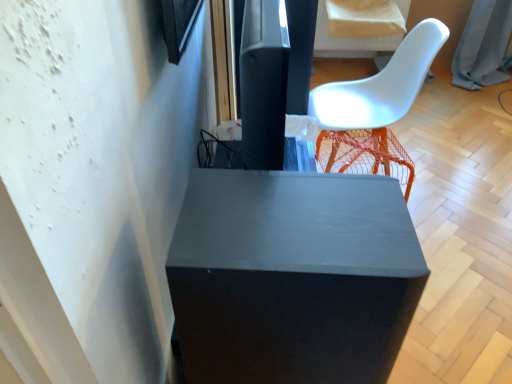
Where is `free spot above matte black cube at center (from a real-world perspective)`? This screenshot has height=384, width=512. free spot above matte black cube at center (from a real-world perspective) is located at coordinates (275, 218).